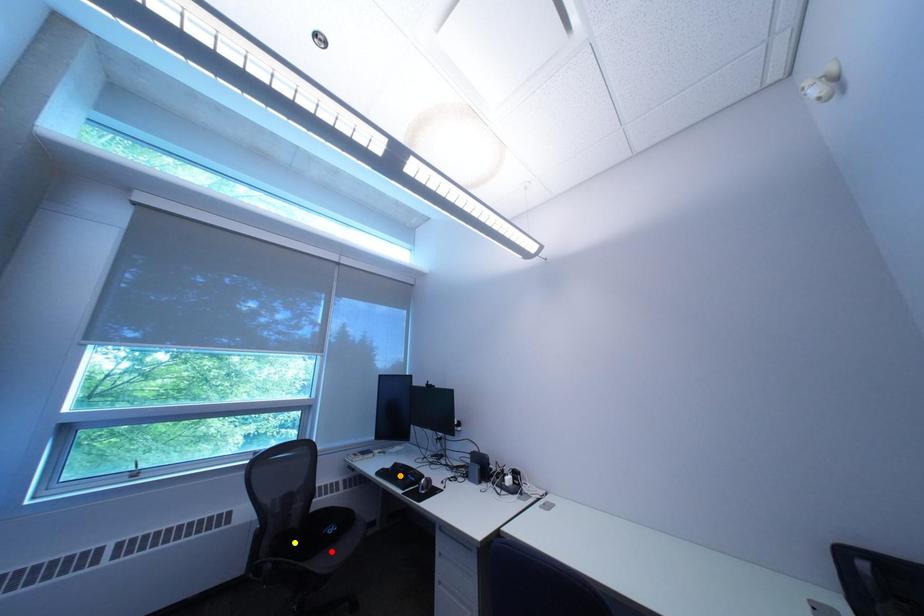
Order these from nearest to farthest:
red point
orange point
yellow point

red point
yellow point
orange point